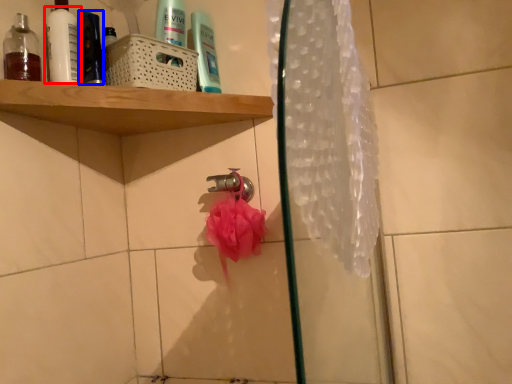
Question: Which object is closer to the camera taking this photo, mouthwash (highlighted by a red box) or toiletry (highlighted by a blue box)?

Choices:
 (A) mouthwash
 (B) toiletry

Answer: (A)